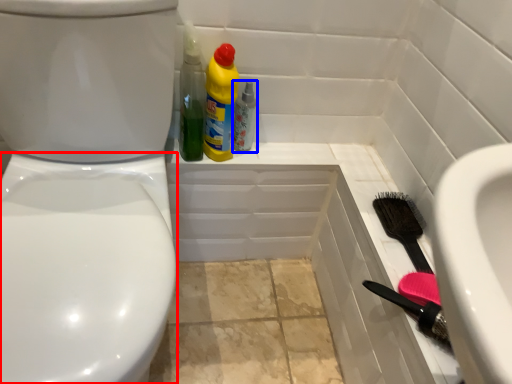
Question: Which point is further to the camera, bidet (highlighted by a red box) or bottle (highlighted by a blue box)?

Choices:
 (A) bidet
 (B) bottle

Answer: (B)